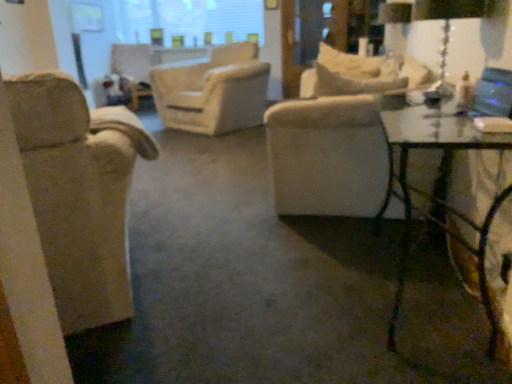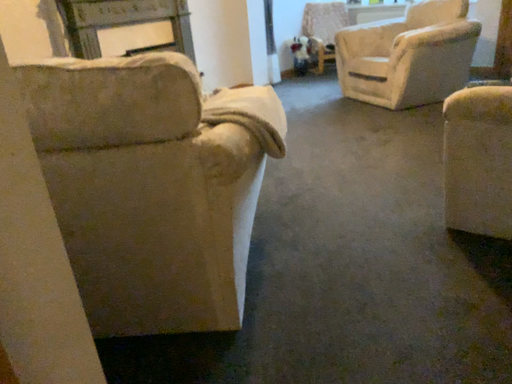
Question: How did the camera likely rotate when shooting the video?

Choices:
 (A) rotated right
 (B) rotated left

Answer: (B)